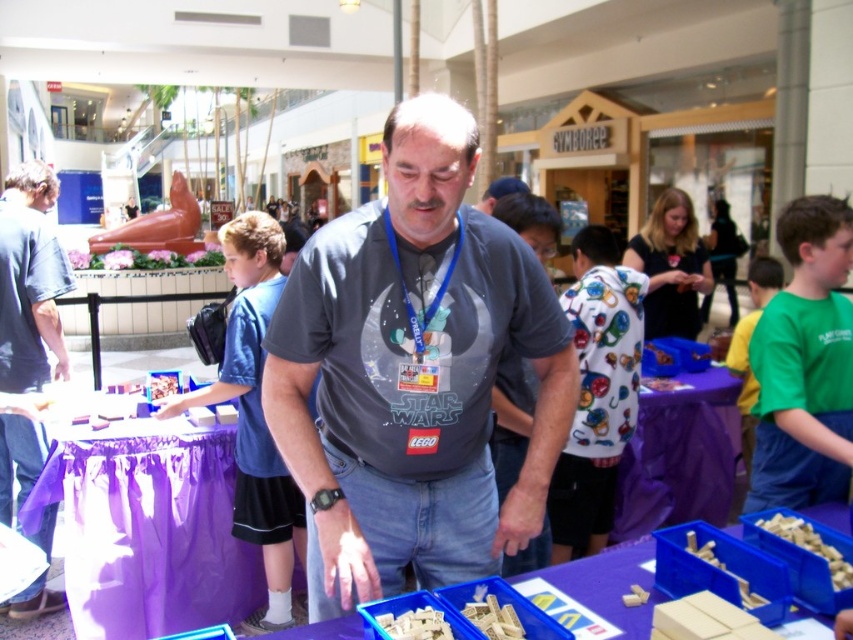
You are a customer at the mall and want to pick up an item from the wooden blocks at center. Where should you look relative to the purple fabric table at center?

The purple fabric table at center is located below the wooden blocks at center, so you should look above the purple fabric table at center to find the wooden blocks at center.

Consider the image. You are a store employee who needs to determine if the gray matte shirt at center can be placed on top of the wooden blocks at lower right without covering them completely. Based on their sizes, is this possible?

The gray matte shirt at center is bigger than wooden blocks at lower right, so placing it on top would cover them completely.

Based on the photo, you are a customer in the mall and want to pick up the wooden blocks at lower right. Which direction should you move relative to the blue plastic bins at center?

The blue plastic bins at center is located below the wooden blocks at lower right, so you should move upward from the blue plastic bins at center to reach the wooden blocks at lower right.